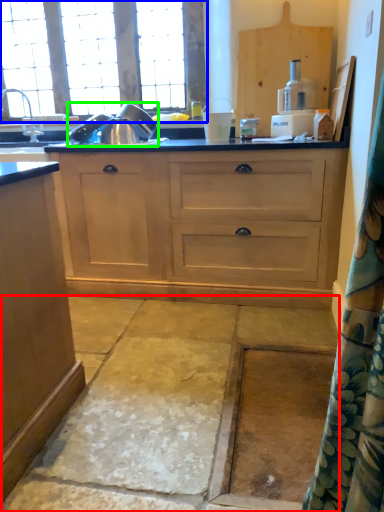
Question: Based on their relative distances, which object is nearer to concrete (highlighted by a red box)? Choose from window (highlighted by a blue box) and appliance (highlighted by a green box).

Choices:
 (A) window
 (B) appliance

Answer: (B)